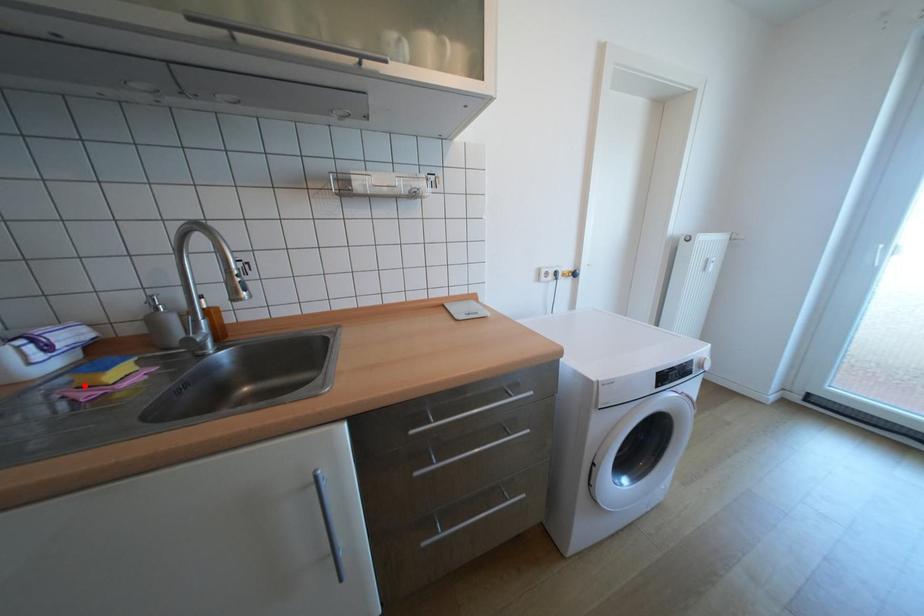
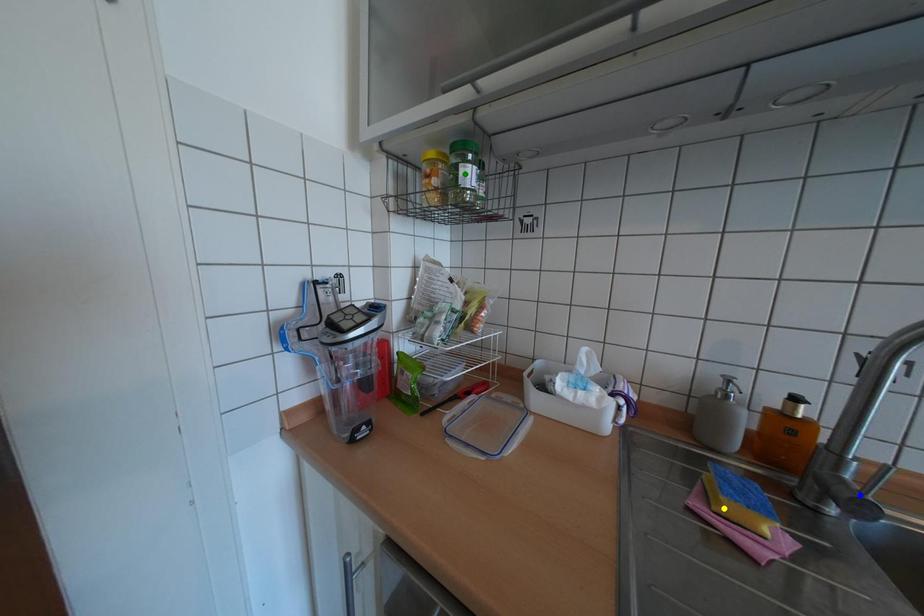
Question: I am providing you with two images of the same scene from different viewpoints. A red point is marked on the first image. You are given multiple points on the second image. Can you choose the point in image 2 that corresponds to the point in image 1?

Choices:
 (A) green point
 (B) blue point
 (C) yellow point

Answer: (C)